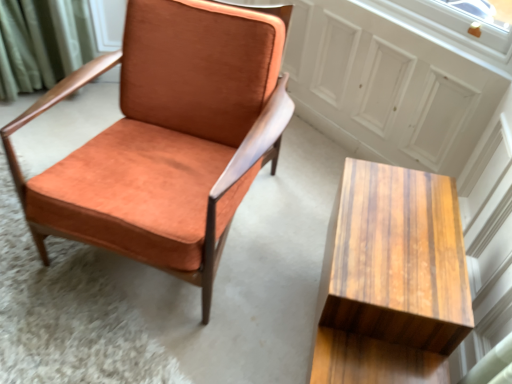
Question: Is orange suede chair at center taller or shorter than wooden table at lower right?

Choices:
 (A) short
 (B) tall

Answer: (B)

Question: In the image, is orange suede chair at center positioned in front of or behind wooden table at lower right?

Choices:
 (A) behind
 (B) front

Answer: (A)

Question: From a real-world perspective, relative to wooden table at lower right, is orange suede chair at center vertically above or below?

Choices:
 (A) above
 (B) below

Answer: (A)

Question: Is point pyautogui.click(x=402, y=314) closer or farther from the camera than point pyautogui.click(x=198, y=122)?

Choices:
 (A) closer
 (B) farther

Answer: (A)

Question: Considering the positions of wooden table at lower right and orange suede chair at center in the image, is wooden table at lower right wider or thinner than orange suede chair at center?

Choices:
 (A) wide
 (B) thin

Answer: (B)

Question: From the image's perspective, is wooden table at lower right located above or below orange suede chair at center?

Choices:
 (A) above
 (B) below

Answer: (B)

Question: Relative to orange suede chair at center, is wooden table at lower right in front or behind?

Choices:
 (A) behind
 (B) front

Answer: (B)